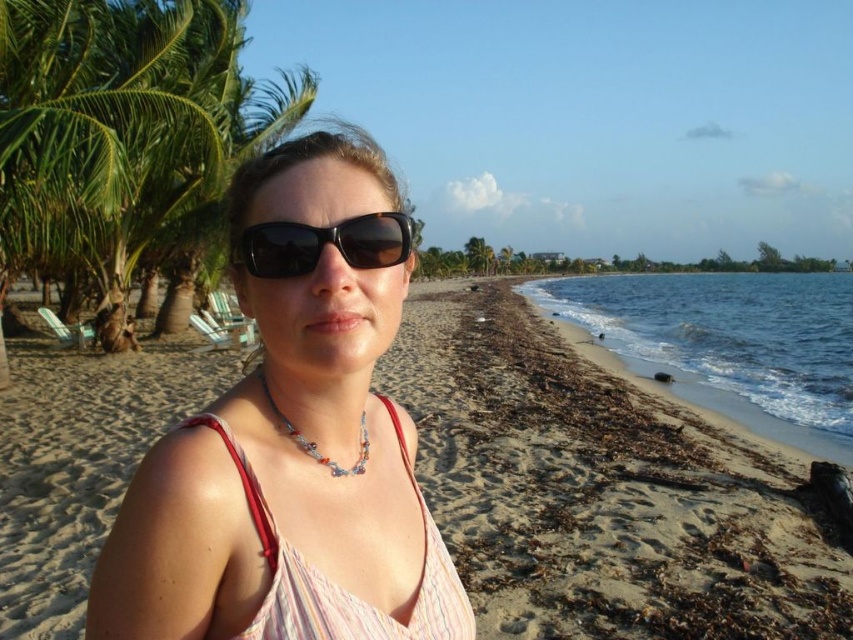
Does beige sandy beach at center appear under green leafy palm tree at upper left?

Correct, beige sandy beach at center is located below green leafy palm tree at upper left.

Does point (73, 624) lie in front of point (115, 172)?

Yes, it is.

Image resolution: width=853 pixels, height=640 pixels. I want to click on beige sandy beach at center, so click(601, 492).

What do you see at coordinates (292, 438) in the screenshot? I see `matte black sunglasses at center` at bounding box center [292, 438].

In order to click on matte black sunglasses at center in this screenshot , I will do `click(292, 438)`.

Where is `matte black sunglasses at center`? The image size is (853, 640). matte black sunglasses at center is located at coordinates (292, 438).

This screenshot has height=640, width=853. Identify the location of green leafy palm tree at upper left. (125, 131).

Is point (144, 204) farther from viewer compared to point (293, 611)?

That is True.

Find the location of a particular element. green leafy palm tree at upper left is located at coordinates (125, 131).